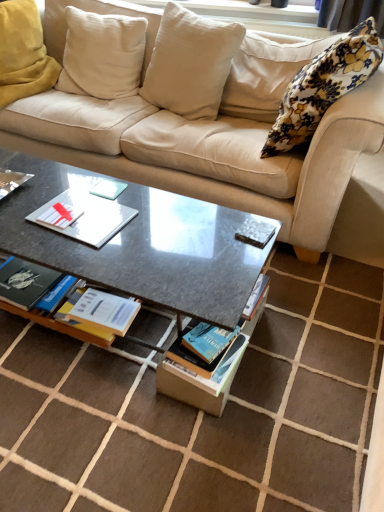
You are a GUI agent. You are given a task and a screenshot of the screen. Output one action in this format:
    pyautogui.click(x=<x>, y=<y>)
    Task: Click on the vacant point above white matte paper at center (from a real-world perspective)
    The image size is (384, 512).
    Given the screenshot: What is the action you would take?
    pyautogui.click(x=78, y=212)